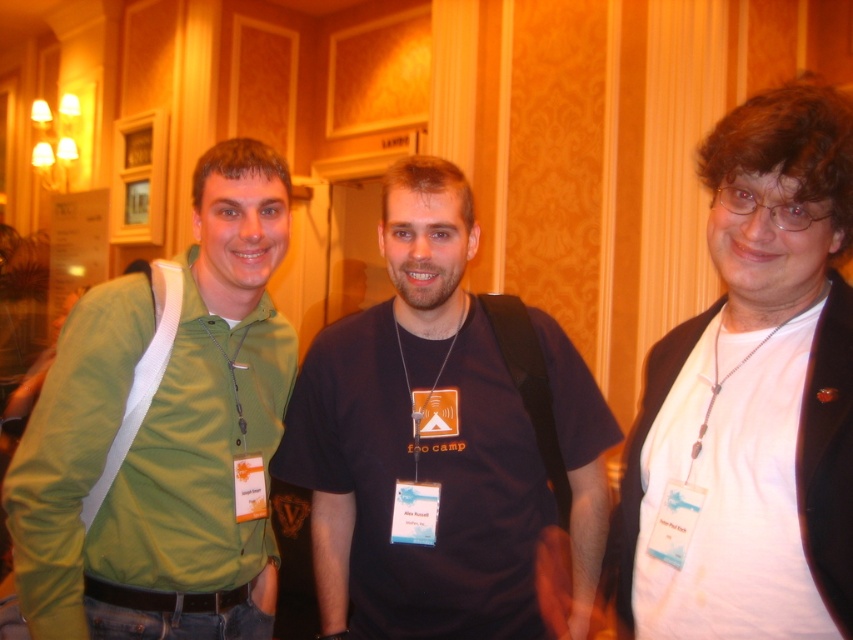
You are at a conference and see two people in the image. The first person is wearing a green fabric shirt at left, and the second is wearing a white matte shirt at right. Which person is positioned more to the left side of the image?

The green fabric shirt at left is positioned more to the left side of the image compared to the white matte shirt at right.